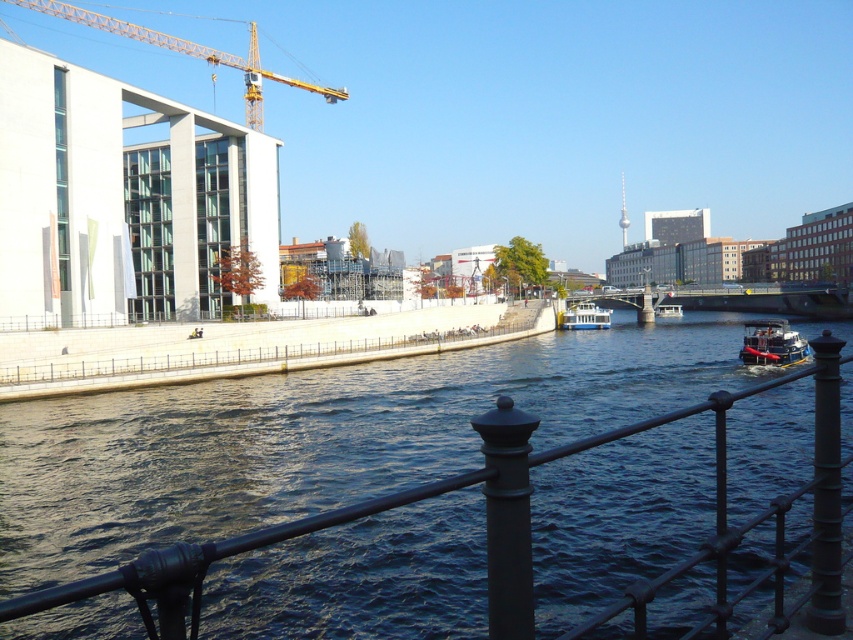
Question: Which object appears closest to the camera in this image?

Choices:
 (A) yellow metallic crane at upper left
 (B) metallic red boat at right
 (C) white plastic boat at center

Answer: (B)

Question: Is dark blue water at center positioned in front of yellow metallic crane at upper left?

Choices:
 (A) no
 (B) yes

Answer: (B)

Question: Which of the following is the farthest from the observer?

Choices:
 (A) dark blue water at center
 (B) metallic red boat at right
 (C) white glossy boat at center

Answer: (C)

Question: Which object is positioned farthest from the metallic red boat at right?

Choices:
 (A) yellow metallic crane at upper left
 (B) white glossy boat at center
 (C) white plastic boat at center
 (D) dark blue water at center

Answer: (A)

Question: In this image, where is yellow metallic crane at upper left located relative to white glossy boat at center?

Choices:
 (A) below
 (B) above

Answer: (B)

Question: In this image, where is metallic red boat at right located relative to white glossy boat at center?

Choices:
 (A) left
 (B) right

Answer: (A)